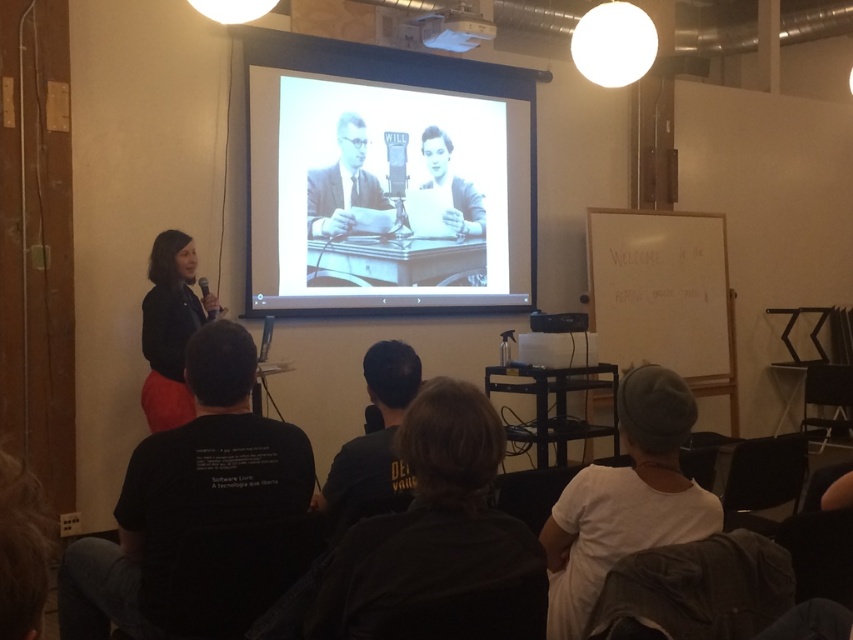
You are standing in the presentation room and want to move to the point marked at coordinates (651,481). If your height is 1.70 meters, will you be able to see the projection screen clearly from there?

The distance between you and the point marked at coordinates (651,481) is 1.70 meters. Since the projection screen is the focal point in the scene, you should be able to see it clearly from that position as long as there are no obstructions. However, the description does not mention any obstacles, so assuming a clear line of sight, yes, you can see the projection screen clearly from there.

From the picture: You are an event planner arranging seating for an upcoming presentation. You need to place a small podium between the white cotton shirt at lower right and the matte black suit at center. Based on their positions, where should the podium be placed relative to the existing attendees?

The podium should be placed between the white cotton shirt at lower right and the matte black suit at center. Since the white cotton shirt at lower right is below the matte black suit at center, the podium should be positioned below the matte black suit at center and above the white cotton shirt at lower right to maintain spatial alignment.

You are an event planner who needs to ensure that all attendees have enough space to sit comfortably. Given that the matte black jacket at left and the matte black suit at center are part of the seating arrangement, which one requires more space due to its size?

The matte black jacket at left requires more space because it is larger in size than the matte black suit at center.